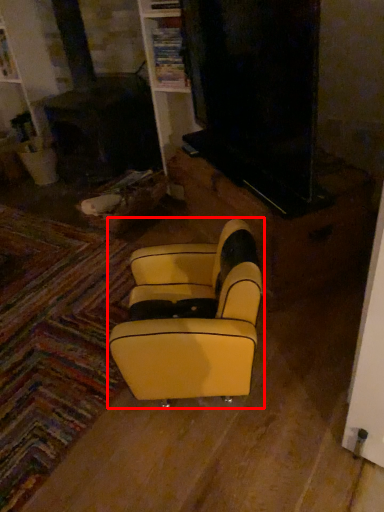
Question: Considering the relative positions of rocking chair (annotated by the red box) and furniture in the image provided, where is rocking chair (annotated by the red box) located with respect to the staircase?

Choices:
 (A) right
 (B) left

Answer: (B)